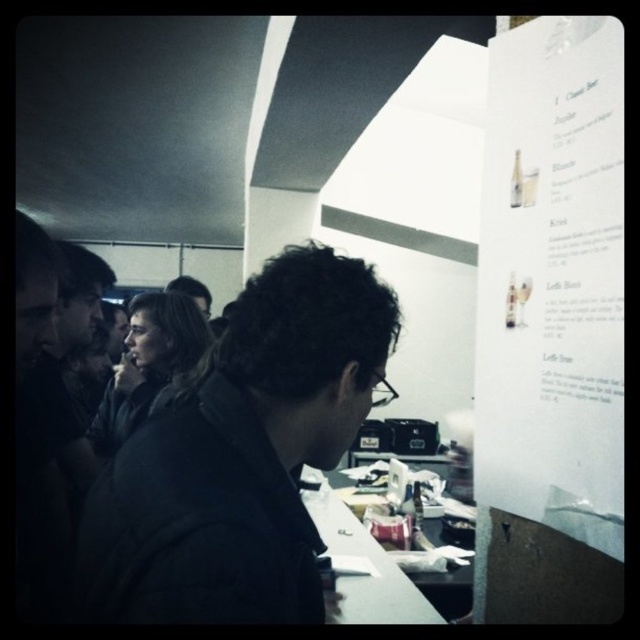
Find the location of a particular element. dark fabric jacket at center is located at coordinates (241, 456).

Can you confirm if dark fabric jacket at center is thinner than white paper menu at upper right?

No, dark fabric jacket at center is not thinner than white paper menu at upper right.

Does point (237, 541) lie behind point (596, 468)?

That is False.

Find the location of a particular element. dark fabric jacket at center is located at coordinates (241, 456).